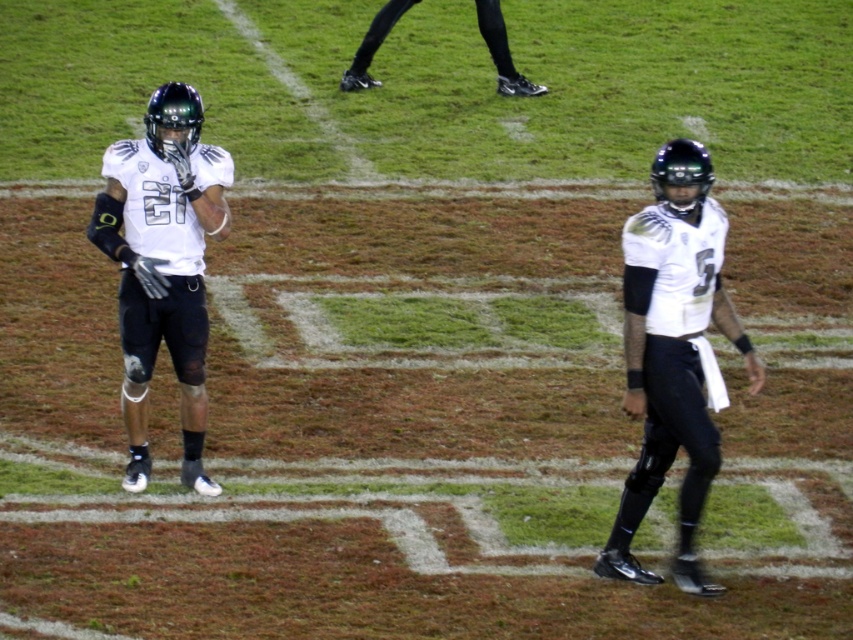
You are a sports analyst watching the game. You need to locate the white matte jersey at center on the field. According to the coordinates provided, where exactly would you find it?

The white matte jersey at center is located at point (672, 353) on the field.

You are a coach observing the football field. You notice the white matte jersey at center and the black synthetic shoe at upper center. Which object is located to the right side of the other?

The white matte jersey at center is positioned on the right side of black synthetic shoe at upper center.

You are a sports analyst observing the night football game. You notice the white matte jersey at center. Where is it positioned relative to the field markings?

The white matte jersey at center is located at point coordinates 0.553 on the x and 0.790 on the y axis, which places it in the central area of the field near the sideline.